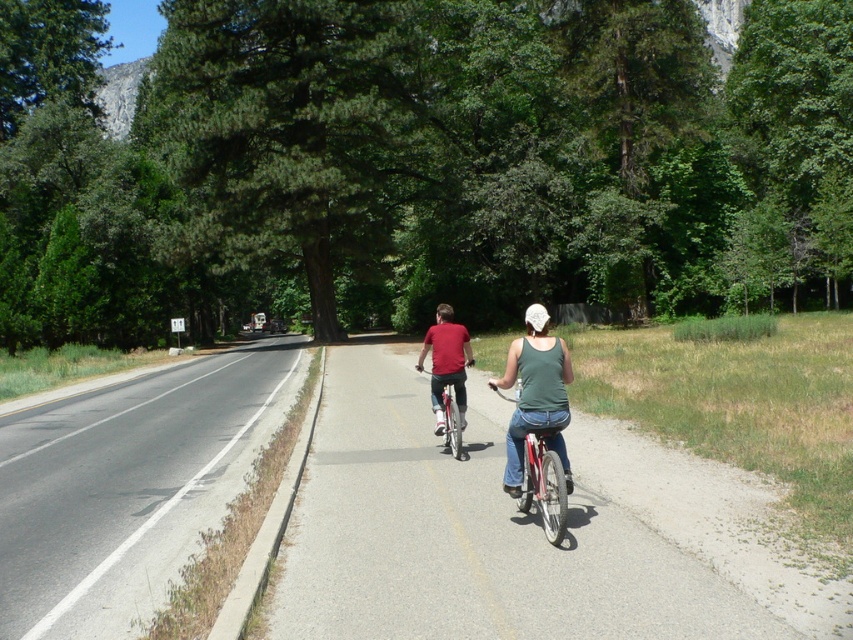
You are a photographer standing at the side of the bike path. You want to capture a photo of both the green fabric tank top at center and the shiny metallic bicycle at center in the same frame. Considering their sizes, which object will appear larger in the photo?

The green fabric tank top at center will appear larger in the photo because its width is larger than that of the shiny metallic bicycle at center.

You are a pedestrian standing on the sidewalk and see the asphalt road at left and the matte red shirt at center. Which object is lower in the image?

The asphalt road at left is below matte red shirt at center, so the asphalt road at left is lower in the image.